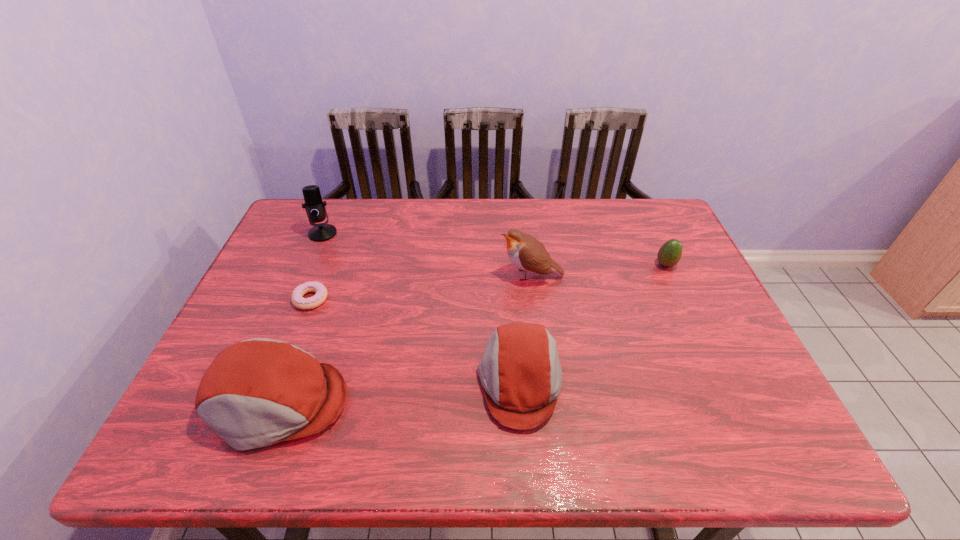
Where is `the left cap`? the left cap is located at coordinates (259, 392).

Identify the location of the right cap. Image resolution: width=960 pixels, height=540 pixels. (520, 371).

Image resolution: width=960 pixels, height=540 pixels. In order to click on the fourth tallest object in this screenshot , I will do `click(520, 371)`.

Locate an element on the screen. the farthest object is located at coordinates (315, 208).

The image size is (960, 540). Find the location of `bird`. bird is located at coordinates (527, 253).

Locate an element on the screen. avocado is located at coordinates (669, 254).

In order to click on the second shortest object in this screenshot , I will do point(669,254).

Image resolution: width=960 pixels, height=540 pixels. In order to click on the shortest object in this screenshot , I will do `click(320, 296)`.

Where is `vacant space positioned on the front-facing side of the shorter cap`? This screenshot has width=960, height=540. vacant space positioned on the front-facing side of the shorter cap is located at coordinates (310, 382).

Identify the location of vacant region located 0.210m on the front-facing side of the shorter cap. This screenshot has width=960, height=540. (385, 382).